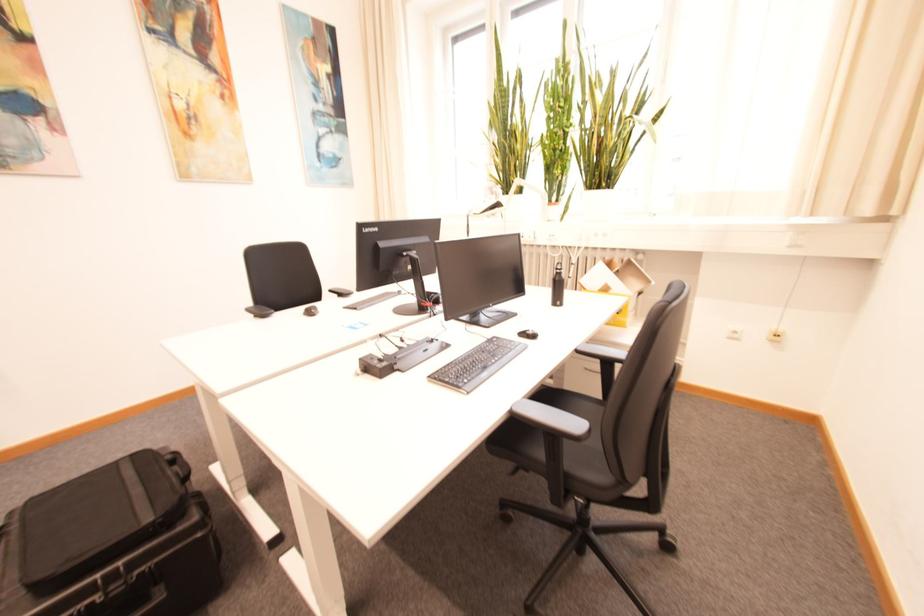
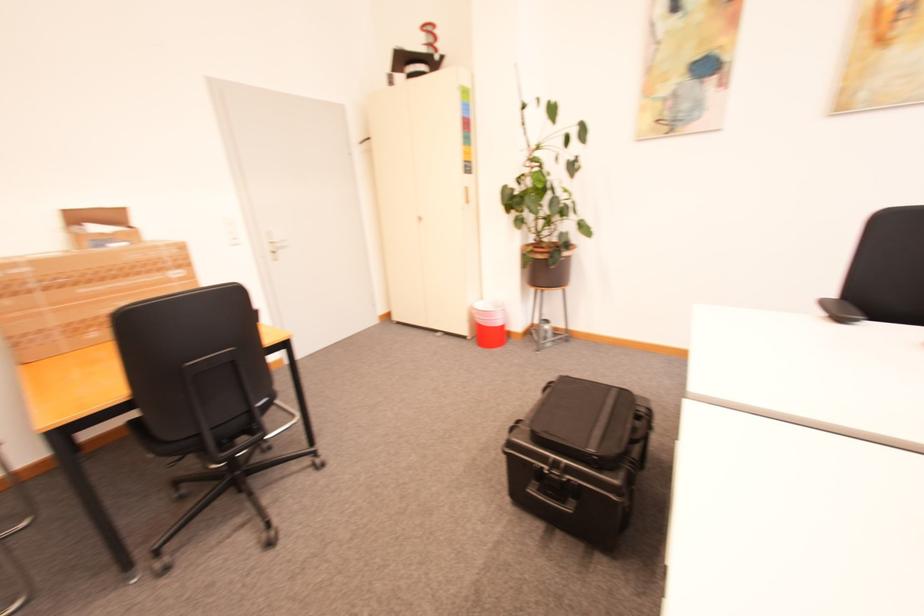
In the second image, find the point that corresponds to (135,564) in the first image.

(574, 467)